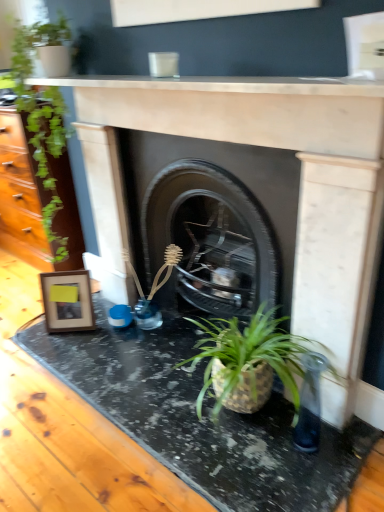
Question: Which direction should I rotate to look at black marble counter top at lower center, which is the 1th counter top in bottom-to-top order?

Choices:
 (A) left
 (B) right

Answer: (A)

Question: Considering the relative sizes of white marble fireplace at upper center, acting as the 1th counter top starting from the top, and wooden photo frame at left in the image provided, is white marble fireplace at upper center, acting as the 1th counter top starting from the top, taller than wooden photo frame at left?

Choices:
 (A) yes
 (B) no

Answer: (B)

Question: Is white marble fireplace at upper center, acting as the 1th counter top starting from the top, bigger than wooden photo frame at left?

Choices:
 (A) no
 (B) yes

Answer: (A)

Question: Is white marble fireplace at upper center, acting as the 1th counter top starting from the top, shorter than wooden photo frame at left?

Choices:
 (A) no
 (B) yes

Answer: (B)

Question: Is white marble fireplace at upper center, which is counted as the 2th counter top, starting from the bottom, to the left of wooden photo frame at left from the viewer's perspective?

Choices:
 (A) no
 (B) yes

Answer: (A)

Question: Is white marble fireplace at upper center, acting as the 1th counter top starting from the top, directly adjacent to wooden photo frame at left?

Choices:
 (A) no
 (B) yes

Answer: (A)

Question: From a real-world perspective, is white marble fireplace at upper center, acting as the 1th counter top starting from the top, located beneath wooden photo frame at left?

Choices:
 (A) yes
 (B) no

Answer: (B)

Question: From the image's perspective, is black marble counter top at lower center, which is the 1th counter top in bottom-to-top order, over white marble fireplace at upper center, which is counted as the 2th counter top, starting from the bottom?

Choices:
 (A) yes
 (B) no

Answer: (B)

Question: Does black marble counter top at lower center, which is the 1th counter top in bottom-to-top order, have a smaller size compared to white marble fireplace at upper center, which is counted as the 2th counter top, starting from the bottom?

Choices:
 (A) no
 (B) yes

Answer: (A)

Question: Does black marble counter top at lower center, which is the 1th counter top in bottom-to-top order, turn towards white marble fireplace at upper center, acting as the 1th counter top starting from the top?

Choices:
 (A) no
 (B) yes

Answer: (A)

Question: Does black marble counter top at lower center, which is the second counter top from top to bottom, come in front of white marble fireplace at upper center, which is counted as the 2th counter top, starting from the bottom?

Choices:
 (A) yes
 (B) no

Answer: (B)

Question: Can you confirm if black marble counter top at lower center, which is the second counter top from top to bottom, is positioned to the right of white marble fireplace at upper center, which is counted as the 2th counter top, starting from the bottom?

Choices:
 (A) no
 (B) yes

Answer: (A)

Question: From a real-world perspective, does black marble counter top at lower center, which is the 1th counter top in bottom-to-top order, stand above white marble fireplace at upper center, acting as the 1th counter top starting from the top?

Choices:
 (A) yes
 (B) no

Answer: (B)

Question: Is wooden photo frame at left further to the viewer compared to white marble fireplace at upper center, acting as the 1th counter top starting from the top?

Choices:
 (A) no
 (B) yes

Answer: (B)